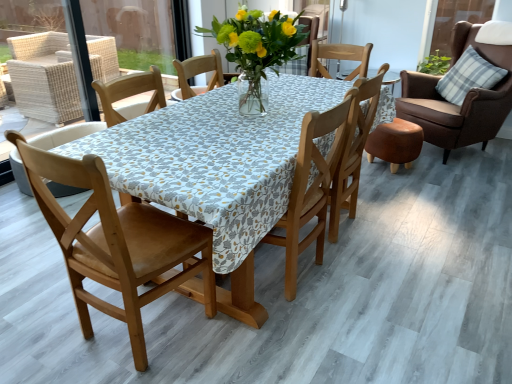
Question: Considering the positions of point (313, 210) and point (425, 102), is point (313, 210) closer or farther from the camera than point (425, 102)?

Choices:
 (A) closer
 (B) farther

Answer: (A)

Question: In the image, is wooden chair at center, which appears as the third chair when viewed from the left, positioned in front of or behind brown leather chair at upper right, positioned as the 5th chair in left-to-right order?

Choices:
 (A) behind
 (B) front

Answer: (B)

Question: Which of these objects is positioned closest to the wooden chair at center, arranged as the 2th chair when viewed from the right?

Choices:
 (A) translucent glass vase at center
 (B) wooden chair at center, the 1th chair when ordered from left to right
 (C) plaid fabric pillow at upper right
 (D) brown leather chair at upper right, positioned as the 5th chair in left-to-right order
 (E) wooden chair at center, placed as the third chair when sorted from right to left

Answer: (E)

Question: Which object is positioned closest to the wooden chair at center, acting as the 2th chair starting from the left?

Choices:
 (A) brown leather chair at upper right, positioned as the 5th chair in left-to-right order
 (B) wooden chair at center, arranged as the 2th chair when viewed from the right
 (C) wooden chair at center, which appears as the third chair when viewed from the left
 (D) wooden chair at center, the fifth chair from the right
 (E) translucent glass vase at center

Answer: (E)